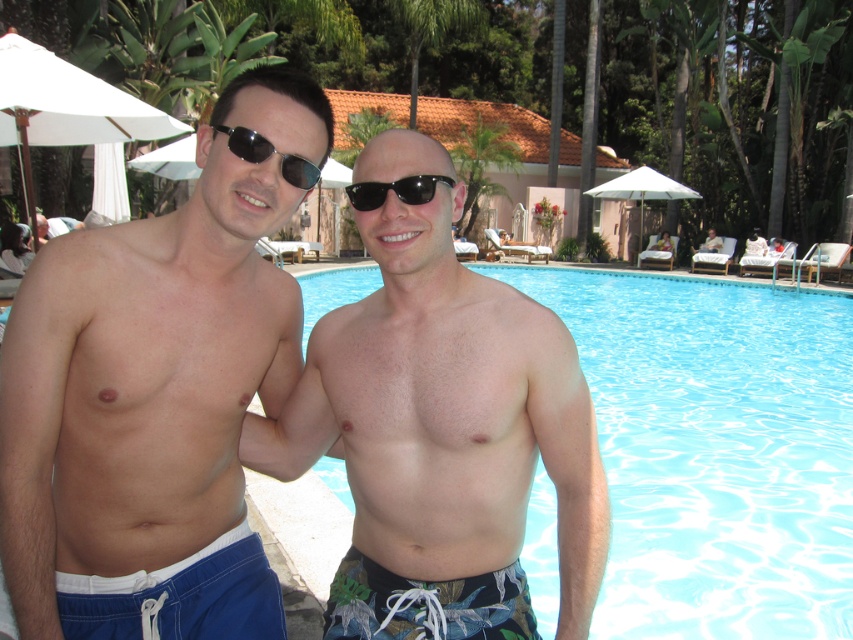
Can you confirm if blue fabric shorts at left is smaller than multicolored fabric shorts at center?

Yes, blue fabric shorts at left is smaller than multicolored fabric shorts at center.

Is blue fabric shorts at left wider than multicolored fabric shorts at center?

Incorrect, blue fabric shorts at left's width does not surpass multicolored fabric shorts at center's.

Between point (236, 561) and point (291, 458), which one is positioned behind?

Point (291, 458)

Where is `blue fabric shorts at left`? blue fabric shorts at left is located at coordinates (148, 416).

Does blue fabric shorts at left have a larger size compared to black reflective sunglasses at left?

Yes.

Which is more to the right, blue fabric shorts at left or black reflective sunglasses at left?

From the viewer's perspective, black reflective sunglasses at left appears more on the right side.

This screenshot has width=853, height=640. In order to click on blue fabric shorts at left in this screenshot , I will do `click(148, 416)`.

Is point (450, 298) less distant than point (415, 188)?

No, it is behind (415, 188).

Who is positioned more to the right, multicolored fabric shorts at center or black plastic sunglasses at center?

multicolored fabric shorts at center is more to the right.

Where is `multicolored fabric shorts at center`? The image size is (853, 640). multicolored fabric shorts at center is located at coordinates 444,440.

This screenshot has width=853, height=640. What are the coordinates of `multicolored fabric shorts at center` in the screenshot? It's located at (444, 440).